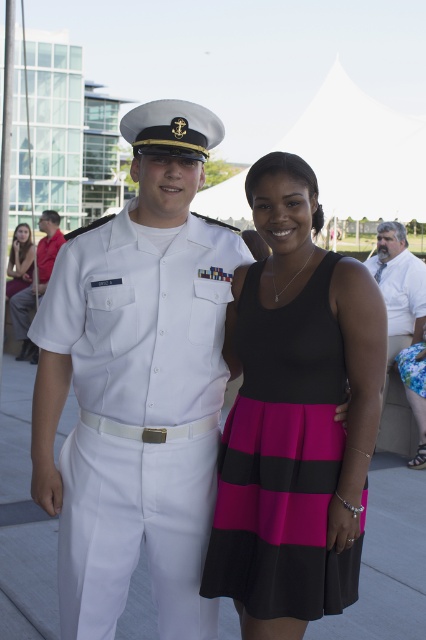
Does white cotton shirt at right appear over matte black dress at center?

Incorrect, white cotton shirt at right is not positioned above matte black dress at center.

Can you confirm if white cotton shirt at right is shorter than matte black dress at center?

No, white cotton shirt at right is not shorter than matte black dress at center.

Who is more distant from viewer, (391,236) or (14,241)?

The point (14,241) is more distant.

Locate an element on the screen. This screenshot has height=640, width=426. white cotton shirt at right is located at coordinates (399, 289).

Between black matte dress at center and white uniform at center, which one has more height?

black matte dress at center is taller.

Where is `black matte dress at center`? The height and width of the screenshot is (640, 426). black matte dress at center is located at coordinates (282, 460).

Is point (331, 260) in front of point (20, 339)?

Yes, point (331, 260) is in front of point (20, 339).

Locate an element on the screen. black matte dress at center is located at coordinates pos(282,460).

Does white matte uniform at center have a greater width compared to matte black dress at center?

Incorrect, white matte uniform at center's width does not surpass matte black dress at center's.

Who is more distant from viewer, (x=224, y=292) or (x=11, y=288)?

Point (x=11, y=288)

Where is `white matte uniform at center`? white matte uniform at center is located at coordinates (140, 417).